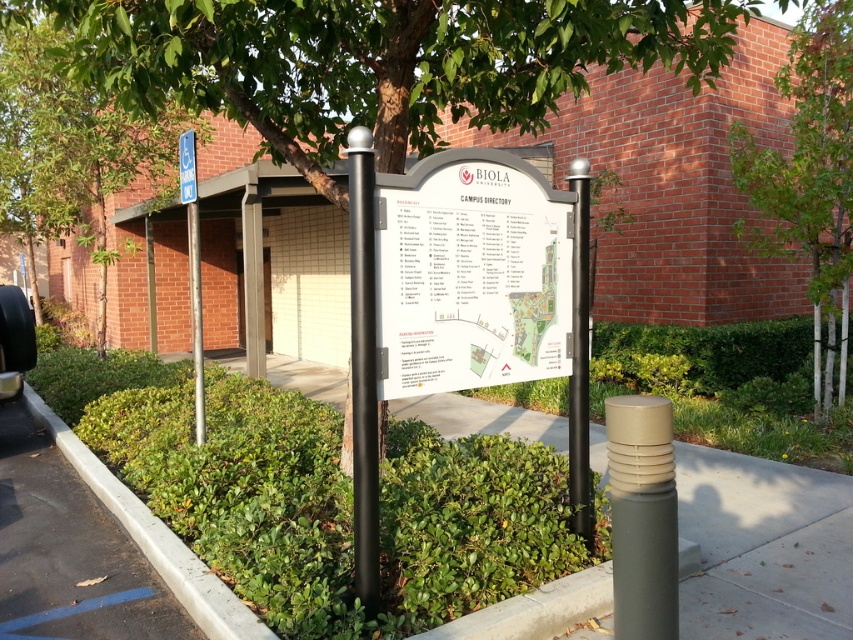
From the picture: You are a delivery driver approaching the Biola University campus. You see the green rubber curb at lower left and the black matte car at lower left. Which one has a greater width?

The green rubber curb at lower left has a greater width than the black matte car at lower left.

You are a visitor at Biola University and need to park your car. You see the green leafy tree at center and the black matte car at lower left. Which object is taller and can provide shade for your car?

The green leafy tree at center is taller than the black matte car at lower left, so it can provide shade for your car.

You are standing in front of the Biola University campus directory sign and want to locate two specific points marked on the sign. The first point is at coordinates point (848, 205) and the second is at point (374, 388). Which of these points is closer to you as you face the sign?

Point (848, 205) is further to the viewer than point (374, 388), so the point at (374, 388) is closer to you.